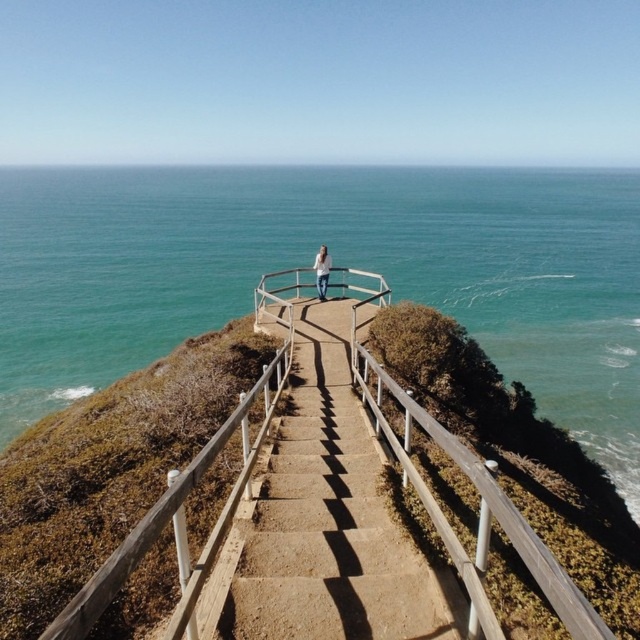
You are a photographer planning to capture the blue water at upper center and brown concrete stairs at center in a single frame. Based on their widths, which object will occupy more horizontal space in your photo?

The blue water at upper center will occupy more horizontal space in the photo since its width surpasses that of the brown concrete stairs at center.